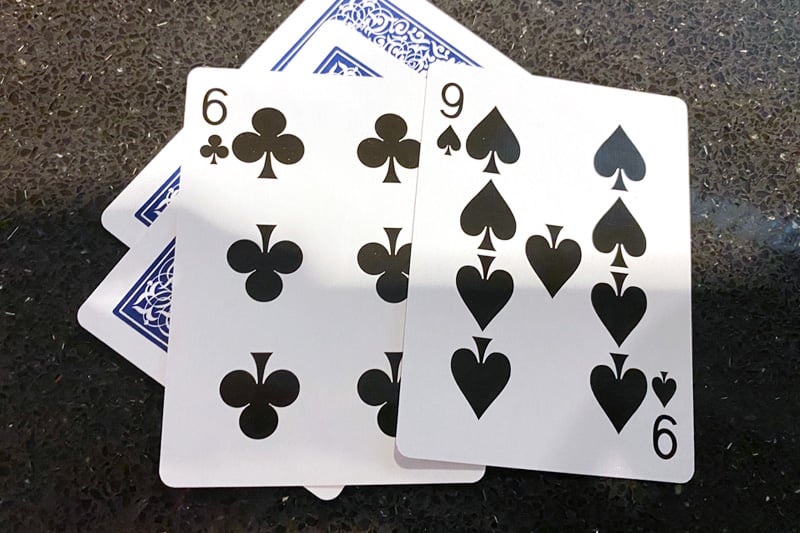
The width and height of the screenshot is (800, 533). Identify the location of speckled grey table. (90, 114).